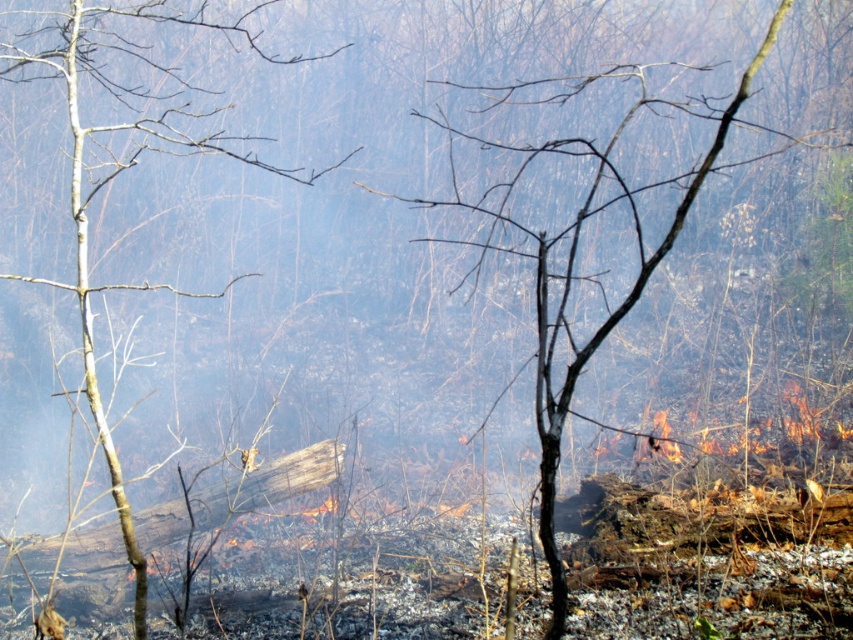
You are a firefighter assessing the damage after a forest fire. You see a brown bark tree at left and a brown bark tree at center. Which tree is closer to you?

The brown bark tree at left is closer to you because it is positioned further to the viewer than the brown bark tree at center.